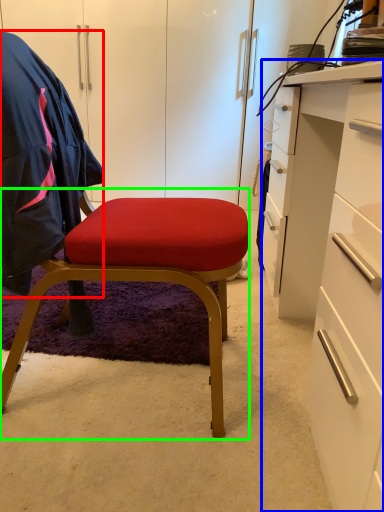
Question: Which is farther away from clothing (highlighted by a red box)? desk (highlighted by a blue box) or chair (highlighted by a green box)?

Choices:
 (A) desk
 (B) chair

Answer: (A)